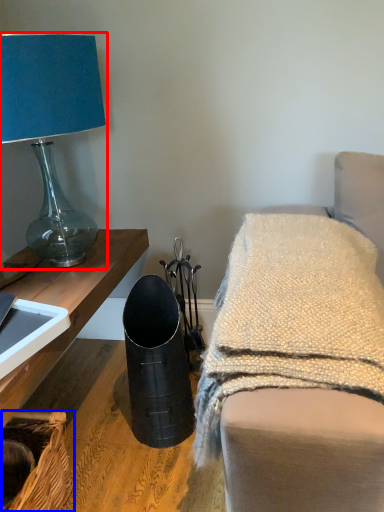
Question: Which object is closer to the camera taking this photo, lamp (highlighted by a red box) or basket (highlighted by a blue box)?

Choices:
 (A) lamp
 (B) basket

Answer: (B)